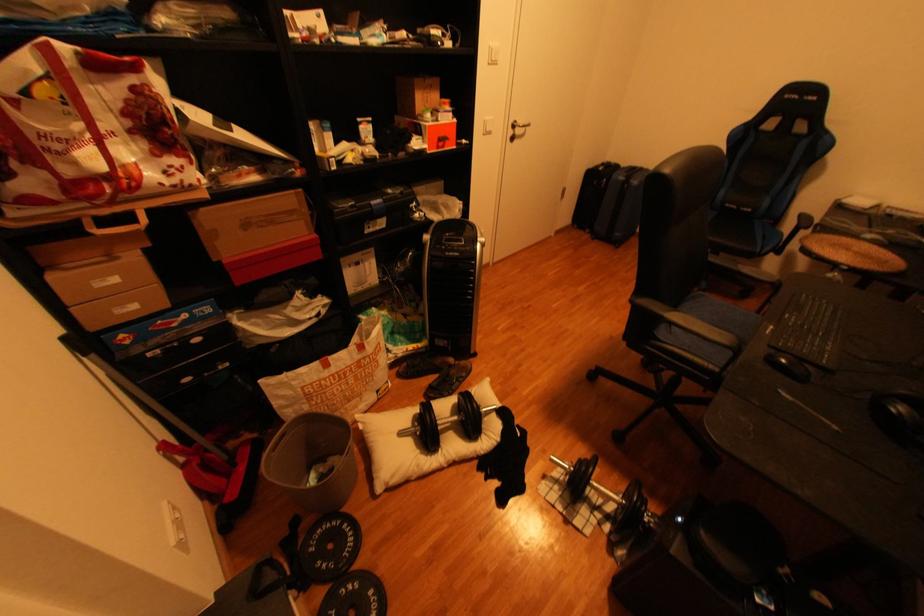
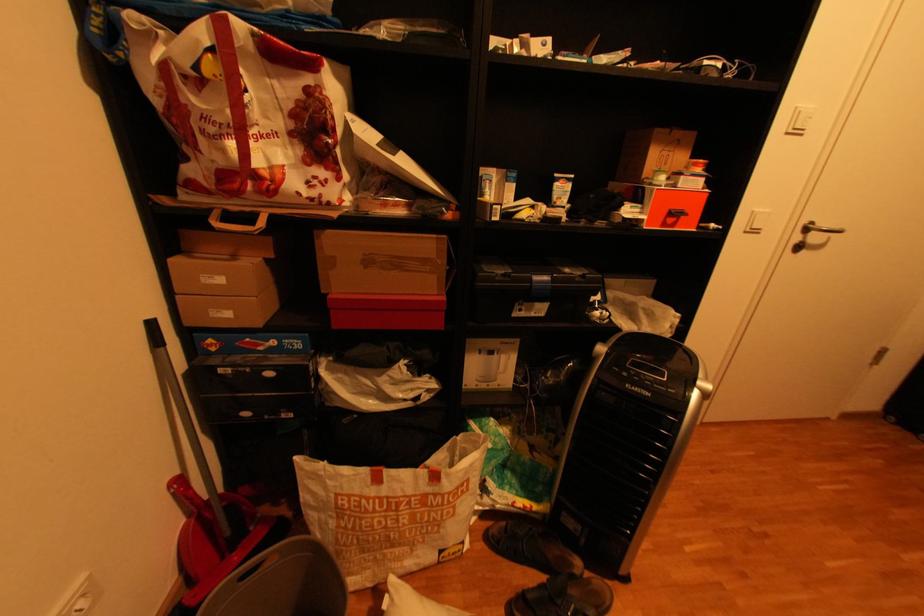
Where in the second image is the point corresponding to (126,281) from the first image?

(231, 281)